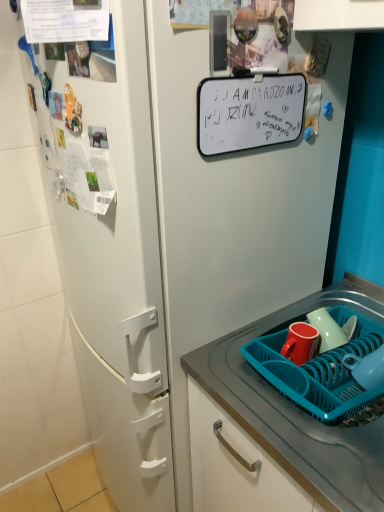
Question: Does blue plastic basket at lower right have a lesser width compared to glossy ceramic mug at lower right?

Choices:
 (A) yes
 (B) no

Answer: (B)

Question: Considering the relative sizes of blue plastic basket at lower right and glossy ceramic mug at lower right in the image provided, is blue plastic basket at lower right shorter than glossy ceramic mug at lower right?

Choices:
 (A) yes
 (B) no

Answer: (B)

Question: Considering the relative positions of blue plastic basket at lower right and glossy ceramic mug at lower right in the image provided, is blue plastic basket at lower right to the left of glossy ceramic mug at lower right from the viewer's perspective?

Choices:
 (A) no
 (B) yes

Answer: (B)

Question: From the image's perspective, is blue plastic basket at lower right on top of glossy ceramic mug at lower right?

Choices:
 (A) no
 (B) yes

Answer: (A)

Question: From a real-world perspective, does blue plastic basket at lower right sit lower than glossy ceramic mug at lower right?

Choices:
 (A) yes
 (B) no

Answer: (A)

Question: From a real-world perspective, is blue plastic basket at lower right on top of glossy ceramic mug at lower right?

Choices:
 (A) yes
 (B) no

Answer: (B)

Question: Does teal plastic tray at lower right appear on the right side of matte red mug at lower right?

Choices:
 (A) no
 (B) yes

Answer: (B)

Question: From the image's perspective, is teal plastic tray at lower right under matte red mug at lower right?

Choices:
 (A) no
 (B) yes

Answer: (B)

Question: From a real-world perspective, is teal plastic tray at lower right positioned over matte red mug at lower right based on gravity?

Choices:
 (A) yes
 (B) no

Answer: (B)

Question: Does teal plastic tray at lower right have a lesser height compared to matte red mug at lower right?

Choices:
 (A) no
 (B) yes

Answer: (A)

Question: Does teal plastic tray at lower right come behind matte red mug at lower right?

Choices:
 (A) yes
 (B) no

Answer: (B)

Question: Is teal plastic tray at lower right smaller than matte red mug at lower right?

Choices:
 (A) yes
 (B) no

Answer: (B)

Question: From the image's perspective, does blue plastic basket at lower right appear higher than matte red mug at lower right?

Choices:
 (A) no
 (B) yes

Answer: (A)